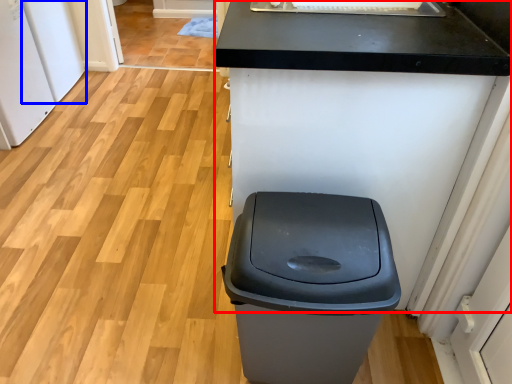
Question: Which point is closer to the camera, counter (highlighted by a red box) or appliance (highlighted by a blue box)?

Choices:
 (A) counter
 (B) appliance

Answer: (A)